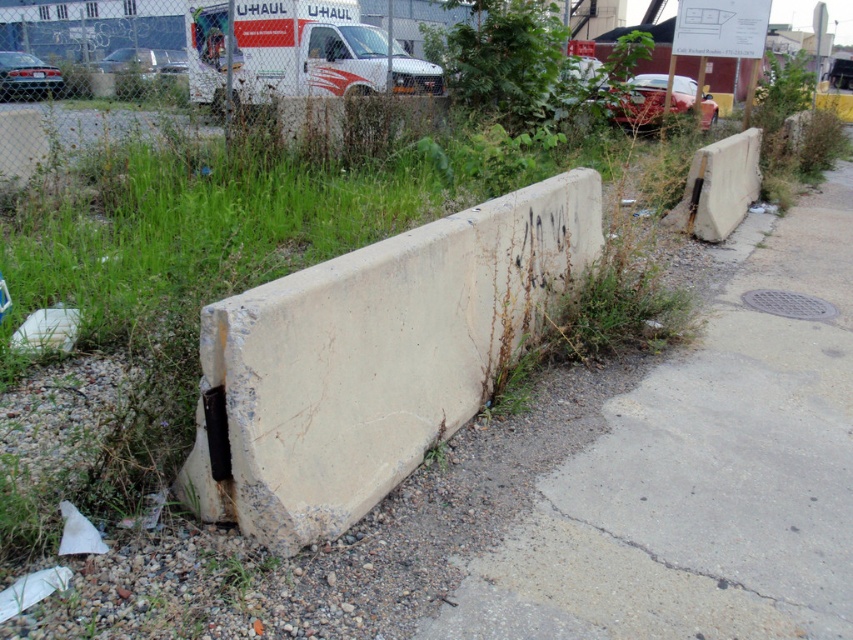
Question: Does concrete pavement at lower right have a larger size compared to white matte van at upper center?

Choices:
 (A) no
 (B) yes

Answer: (A)

Question: Does concrete pavement at lower right have a greater width compared to white concrete barrier at center?

Choices:
 (A) yes
 (B) no

Answer: (A)

Question: Does white concrete barrier at center have a larger size compared to white matte van at upper center?

Choices:
 (A) yes
 (B) no

Answer: (B)

Question: Which of the following is the farthest from the observer?

Choices:
 (A) white matte van at upper center
 (B) concrete pavement at lower right

Answer: (A)

Question: Which point is farther to the camera?

Choices:
 (A) (575, 273)
 (B) (206, 70)
 (C) (519, 609)

Answer: (B)

Question: Which of the following is the closest to the observer?

Choices:
 (A) white matte van at upper center
 (B) concrete pavement at lower right

Answer: (B)